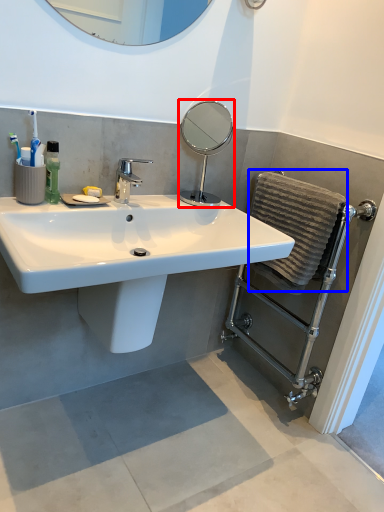
Question: Among these objects, which one is nearest to the camera, mirror (highlighted by a red box) or bath towel (highlighted by a blue box)?

Choices:
 (A) mirror
 (B) bath towel

Answer: (B)